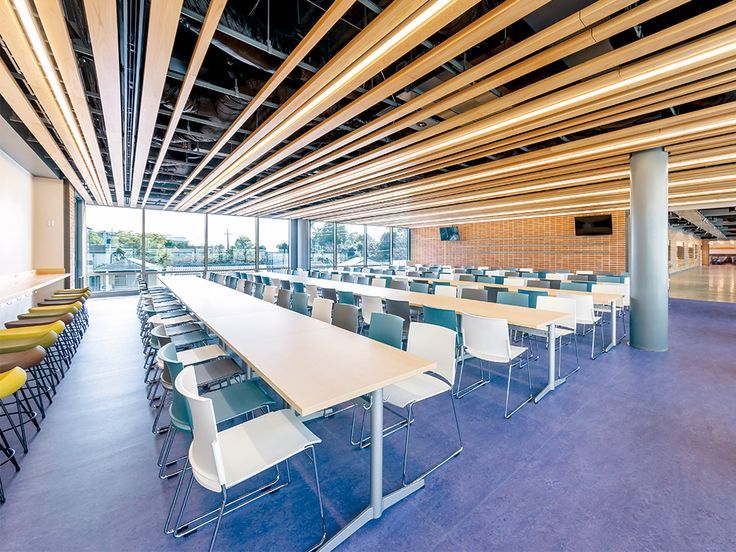
Find the location of a particular element. This screenshot has width=736, height=552. table is located at coordinates [321, 375], [539, 322], [612, 296], [570, 279].